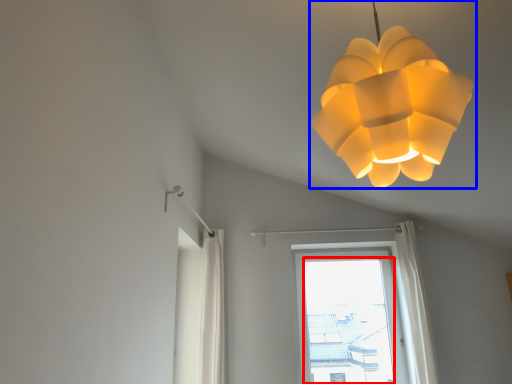
Question: Which object appears farthest to the camera in this image, window screen (highlighted by a red box) or lamp (highlighted by a blue box)?

Choices:
 (A) window screen
 (B) lamp

Answer: (A)